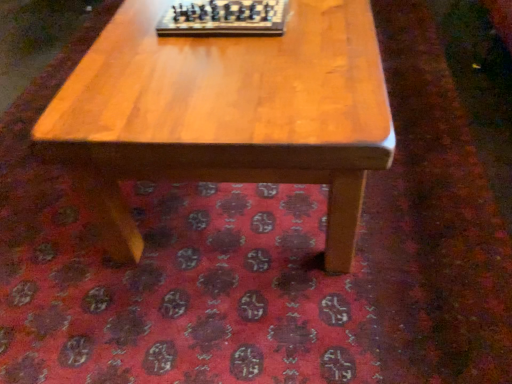
Question: Considering the positions of light brown wood coffee table at center and wooden chessboard at center in the image, is light brown wood coffee table at center bigger or smaller than wooden chessboard at center?

Choices:
 (A) big
 (B) small

Answer: (A)

Question: Is light brown wood coffee table at center wider or thinner than wooden chessboard at center?

Choices:
 (A) wide
 (B) thin

Answer: (A)

Question: Which is correct: light brown wood coffee table at center is inside wooden chessboard at center, or outside of it?

Choices:
 (A) outside
 (B) inside

Answer: (A)

Question: In the image, is wooden chessboard at center on the left side or the right side of light brown wood coffee table at center?

Choices:
 (A) left
 (B) right

Answer: (A)

Question: In terms of size, does wooden chessboard at center appear bigger or smaller than light brown wood coffee table at center?

Choices:
 (A) small
 (B) big

Answer: (A)

Question: From a real-world perspective, relative to light brown wood coffee table at center, is wooden chessboard at center vertically above or below?

Choices:
 (A) above
 (B) below

Answer: (A)

Question: Is wooden chessboard at center wider or thinner than light brown wood coffee table at center?

Choices:
 (A) wide
 (B) thin

Answer: (B)